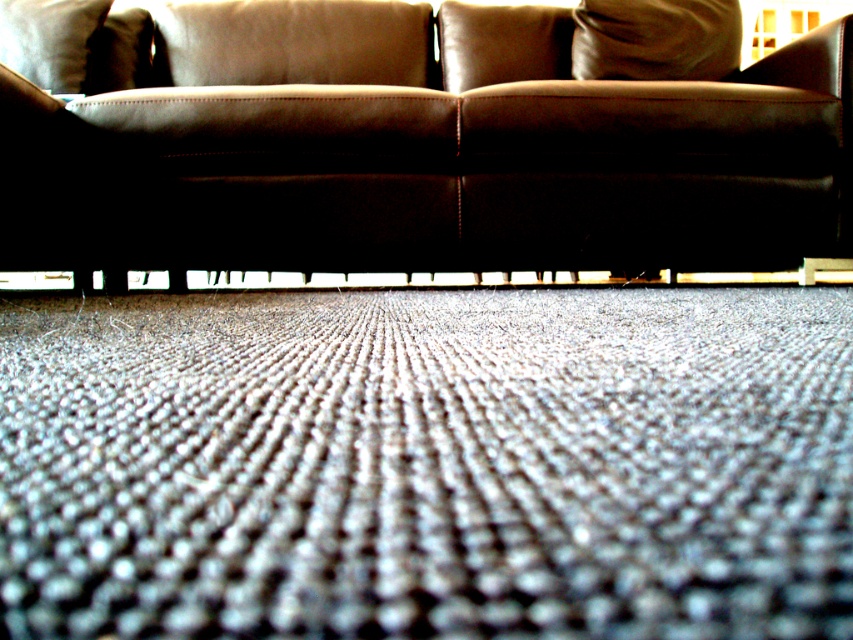
Between point (381, 632) and point (566, 243), which one is positioned behind?

The point (566, 243) is behind.

Is point (120, 445) less distant than point (758, 220)?

Yes, point (120, 445) is in front of point (758, 220).

At what (x,y) coordinates should I click in order to perform the action: click on gray textured mat at lower center. Please return your answer as a coordinate pair (x, y). This screenshot has width=853, height=640. Looking at the image, I should click on (427, 464).